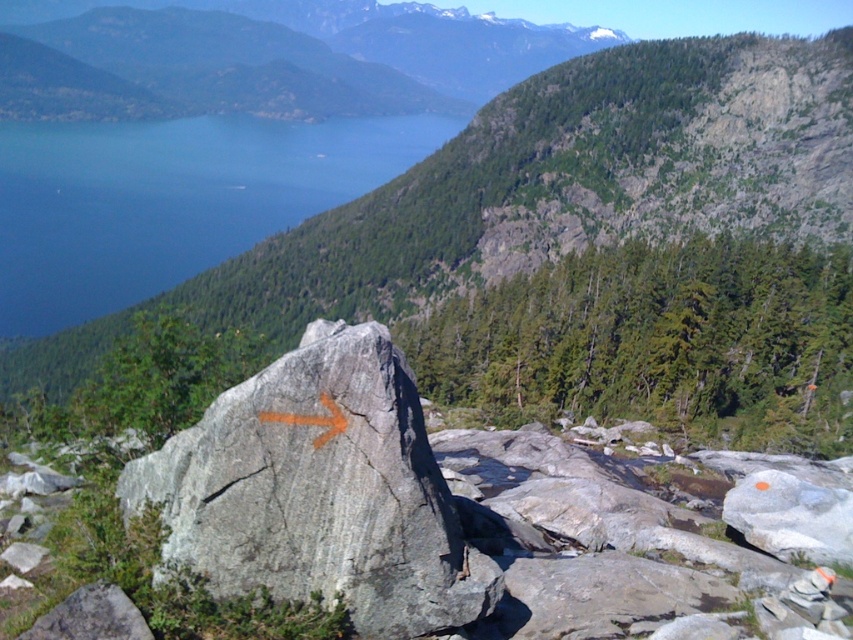
You are a hiker who needs to place a small GPS tracker on either the gray rough boulder at center or the orange painted arrow at center. Which object would allow the tracker to be more visible to passing hikers?

The orange painted arrow at center would make the GPS tracker more visible because it is smaller than the gray rough boulder at center, making the tracker stand out more against its surface.

You are a hiker who wants to take a photo of the orange painted arrow at center. You are currently standing at the gray rough boulder at center. Can you move forward to get a closer shot without blocking the arrow with the boulder?

The gray rough boulder at center is in front of the orange painted arrow at center, so if you move forward from the boulder, it will block the arrow. You should stay behind the boulder to keep the arrow visible.

You are hiking and come across a rocky path with the blue water at upper left and the white smooth rock at lower right. Which object is closer to you as you stand on the path?

The white smooth rock at lower right is closer to you because it is positioned behind the blue water at upper left, meaning the blue water is in front of it.